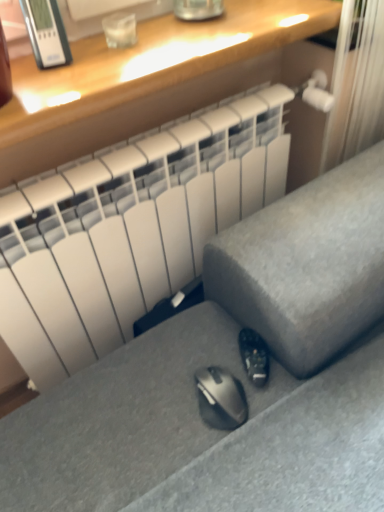
This screenshot has height=512, width=384. What do you see at coordinates (254, 356) in the screenshot? I see `black matte shoe at lower center` at bounding box center [254, 356].

What do you see at coordinates (150, 80) in the screenshot? I see `matte wood desk at upper center` at bounding box center [150, 80].

Locate an element on the screen. This screenshot has height=512, width=384. black matte shoe at lower center is located at coordinates (254, 356).

Does satin gray sofa at lower center have a lesser height compared to matte wood desk at upper center?

In fact, satin gray sofa at lower center may be taller than matte wood desk at upper center.

Does point (342, 301) come behind point (261, 6)?

No, (342, 301) is in front of (261, 6).

Considering the relative sizes of satin gray sofa at lower center and matte wood desk at upper center in the image provided, is satin gray sofa at lower center thinner than matte wood desk at upper center?

Incorrect, the width of satin gray sofa at lower center is not less than that of matte wood desk at upper center.

Would you consider satin gray sofa at lower center to be distant from matte wood desk at upper center?

satin gray sofa at lower center is near matte wood desk at upper center, not far away.

From a real-world perspective, between black matte shoe at lower center and matte wood desk at upper center, who is vertically higher?

In real-world perspective, matte wood desk at upper center is above.

Is point (263, 384) closer or farther from the camera than point (268, 32)?

Point (263, 384) is positioned closer to the camera compared to point (268, 32).

I want to click on shoe below the satin gray sofa at lower center (from the image's perspective), so click(254, 356).

Which of these two, satin gray sofa at lower center or black matte shoe at lower center, is bigger?

satin gray sofa at lower center.

Consider the image. Which object is positioned more to the right, satin gray sofa at lower center or black matte shoe at lower center?

satin gray sofa at lower center.

How different are the orientations of black matte shoe at lower center and satin gray sofa at lower center in degrees?

black matte shoe at lower center and satin gray sofa at lower center are facing 62.3 degrees away from each other.

Is black matte shoe at lower center inside the boundaries of satin gray sofa at lower center, or outside?

black matte shoe at lower center exists entirely within satin gray sofa at lower center.

In terms of height, does black matte shoe at lower center look taller or shorter compared to satin gray sofa at lower center?

In the image, black matte shoe at lower center appears to be shorter than satin gray sofa at lower center.

Are matte wood desk at upper center and satin gray sofa at lower center making contact?

No, matte wood desk at upper center is not in contact with satin gray sofa at lower center.

Does matte wood desk at upper center turn towards satin gray sofa at lower center?

Yes, matte wood desk at upper center is turned towards satin gray sofa at lower center.

Find the location of a particular element. The width and height of the screenshot is (384, 512). desk on the left side of satin gray sofa at lower center is located at coordinates (150, 80).

Locate an element on the screen. The image size is (384, 512). shoe lying behind the matte wood desk at upper center is located at coordinates (254, 356).

Is matte wood desk at upper center completely or partially outside of black matte shoe at lower center?

matte wood desk at upper center is positioned outside black matte shoe at lower center.

Is point (20, 73) farther from viewer compared to point (250, 357)?

That is True.

This screenshot has width=384, height=512. What are the coordinates of `desk that appears behind the satin gray sofa at lower center` in the screenshot? It's located at (150, 80).

I want to click on desk to the left of black matte shoe at lower center, so click(x=150, y=80).

Which object lies further to the anchor point black matte shoe at lower center, satin gray sofa at lower center or matte wood desk at upper center?

matte wood desk at upper center lies further to black matte shoe at lower center than the other object.

Estimate the real-world distances between objects in this image. Which object is closer to satin gray sofa at lower center, matte wood desk at upper center or black matte shoe at lower center?

black matte shoe at lower center lies closer to satin gray sofa at lower center than the other object.

Considering their positions, is black matte shoe at lower center positioned closer to matte wood desk at upper center than satin gray sofa at lower center?

satin gray sofa at lower center.

Looking at the image, which one is located closer to black matte shoe at lower center, matte wood desk at upper center or satin gray sofa at lower center?

The object closer to black matte shoe at lower center is satin gray sofa at lower center.

Looking at the image, which one is located further to matte wood desk at upper center, satin gray sofa at lower center or black matte shoe at lower center?

black matte shoe at lower center lies further to matte wood desk at upper center than the other object.

From the image, which object appears to be nearer to satin gray sofa at lower center, black matte shoe at lower center or matte wood desk at upper center?

The object closer to satin gray sofa at lower center is black matte shoe at lower center.

Locate an element on the screen. This screenshot has height=512, width=384. desk located between satin gray sofa at lower center and black matte shoe at lower center in the depth direction is located at coordinates (150, 80).